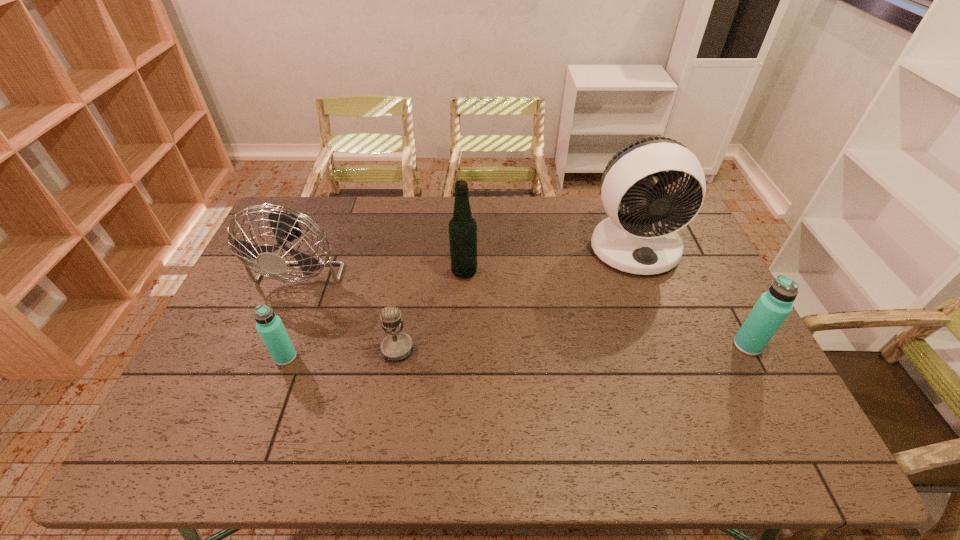
Locate an element on the screen. vacant region at the far edge of the desktop is located at coordinates (486, 222).

I want to click on free region at the near edge, so click(x=631, y=395).

Locate an element on the screen. The width and height of the screenshot is (960, 540). vacant space at the left edge is located at coordinates (287, 297).

This screenshot has width=960, height=540. In the image, there is a desktop. Identify the location of vacant space at the right edge. (719, 305).

The image size is (960, 540). In order to click on free space at the far left corner of the desktop in this screenshot , I will do `click(320, 207)`.

Identify the location of vacant space at the near left corner of the desktop. (204, 397).

The height and width of the screenshot is (540, 960). Find the location of `vacant area at the near right corner of the desktop`. vacant area at the near right corner of the desktop is located at coordinates (757, 413).

Where is `free space between the fourth object from left to right and the left fan`? This screenshot has width=960, height=540. free space between the fourth object from left to right and the left fan is located at coordinates (386, 266).

The image size is (960, 540). Identify the location of vacant space that is in between the fourth tallest object and the alcohol. (606, 308).

Locate an element on the screen. The image size is (960, 540). empty space that is in between the right thermos bottle and the fifth object from left to right is located at coordinates (690, 296).